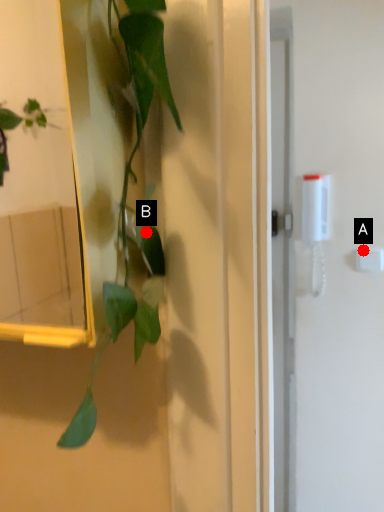
Question: Two points are circled on the image, labeled by A and B beside each circle. Which point is further to the camera?

Choices:
 (A) A is further
 (B) B is further

Answer: (A)